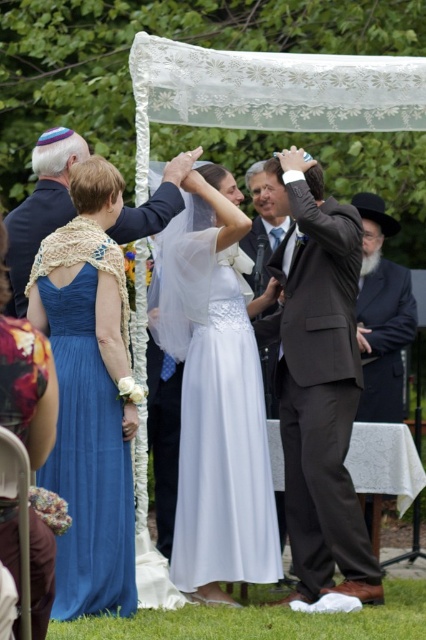
Question: Which point appears closest to the camera in this image?

Choices:
 (A) (397, 372)
 (B) (29, 225)
 (C) (294, 332)

Answer: (C)

Question: Can you confirm if white satin dress at center is positioned to the left of matte black suit at center?

Choices:
 (A) no
 (B) yes

Answer: (A)

Question: Which of the following is the closest to the observer?

Choices:
 (A) dark brown suit at center
 (B) blue satin dress at left
 (C) matte black suit at center
 (D) black wool hat at right

Answer: (B)

Question: Can you confirm if matte black suit at center is wider than black wool hat at right?

Choices:
 (A) yes
 (B) no

Answer: (A)

Question: Which of these objects is positioned closest to the white satin dress at center?

Choices:
 (A) black wool hat at right
 (B) dark brown suit at center
 (C) blue satin dress at left

Answer: (B)

Question: Is white satin dress at center smaller than matte black suit at center?

Choices:
 (A) yes
 (B) no

Answer: (B)